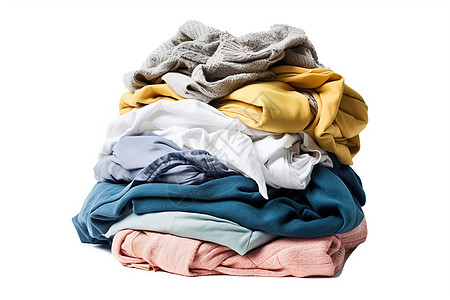
You are a GUI agent. You are given a task and a screenshot of the screen. Output one action in this format:
    pyautogui.click(x=<x>, y=<y>)
    Task: Click on the laundry
    This screenshot has height=300, width=450.
    Given the screenshot: What is the action you would take?
    pyautogui.click(x=171, y=257), pyautogui.click(x=220, y=216), pyautogui.click(x=199, y=231), pyautogui.click(x=150, y=157), pyautogui.click(x=236, y=138), pyautogui.click(x=285, y=154), pyautogui.click(x=283, y=105), pyautogui.click(x=200, y=78), pyautogui.click(x=236, y=58)